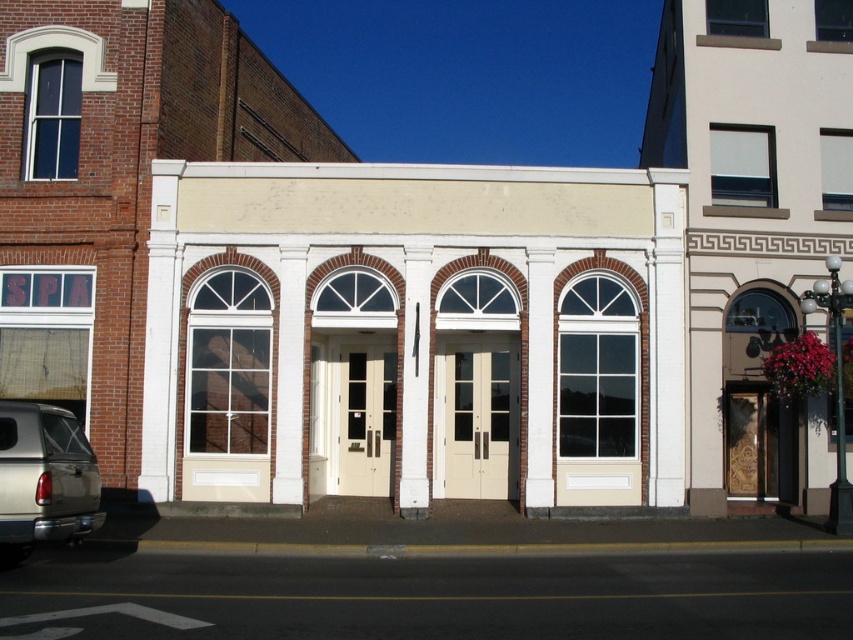
Looking at this image, you are standing on the sidewalk in front of the central building with white painted wood doors at center. You want to enter the building. Which direction should you walk to reach the doors?

You should walk directly towards the white painted wood doors at center located at point (415, 332) since they are the entrance to the building.

You are a delivery driver who needs to unload a package from your metallic silver truck at lower left. The package needs to be delivered to the white painted wood doors at center. Based on the scene, can you drive the truck closer to the doors to make unloading easier?

The white painted wood doors at center is above the metallic silver truck at lower left, meaning the truck is positioned lower in elevation. Since the doors are higher up, you cannot drive the truck closer to them as they are on a different level.

You are a delivery person trying to park your metallic silver truck at lower left near the white painted wood doors at center. Based on the scene, can your truck fit in the space between the doors and the building to the left?

The white painted wood doors at center is bigger than metallic silver truck at lower left, so the truck can fit in the space between the doors and the building to the left.